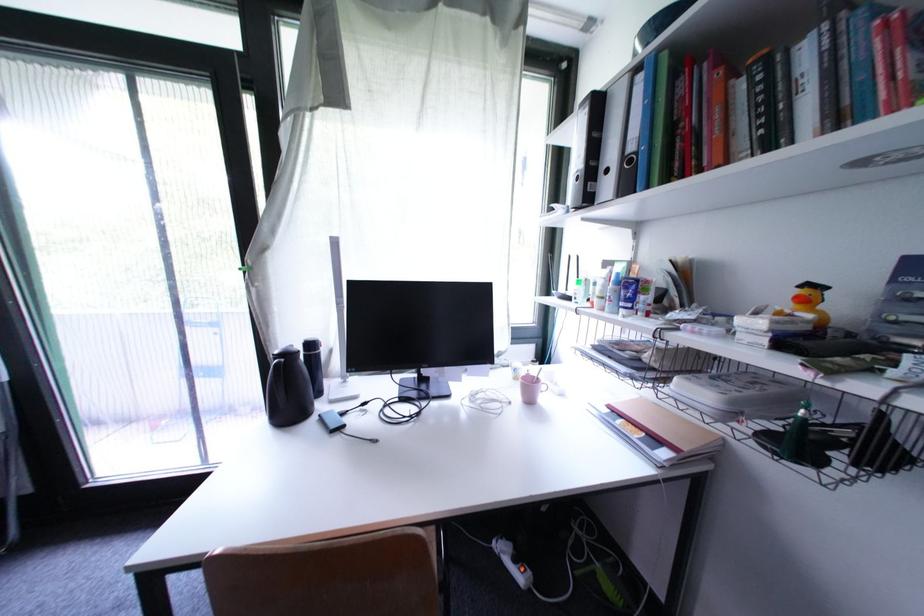
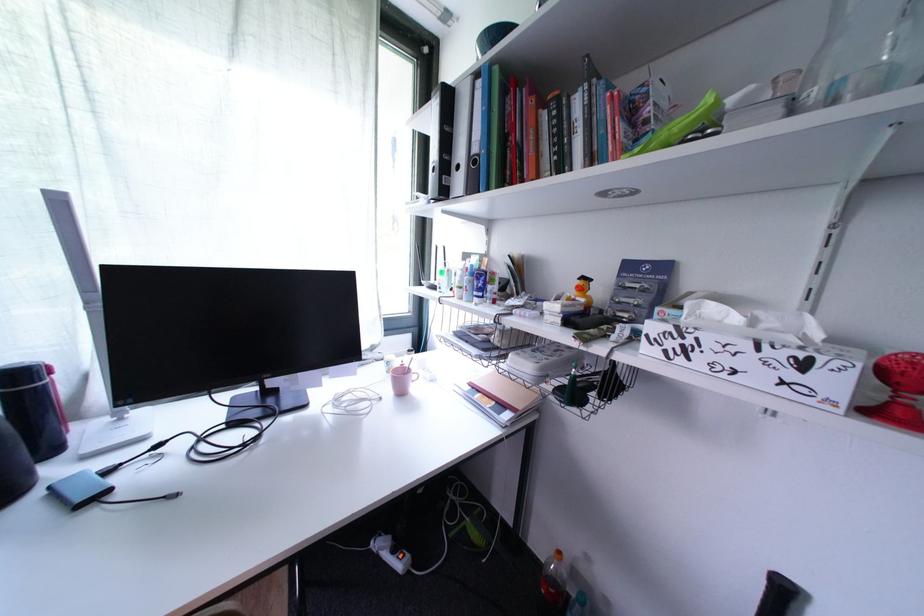
Locate, in the second image, the point that corresponds to point 808,290 in the first image.

(588, 282)